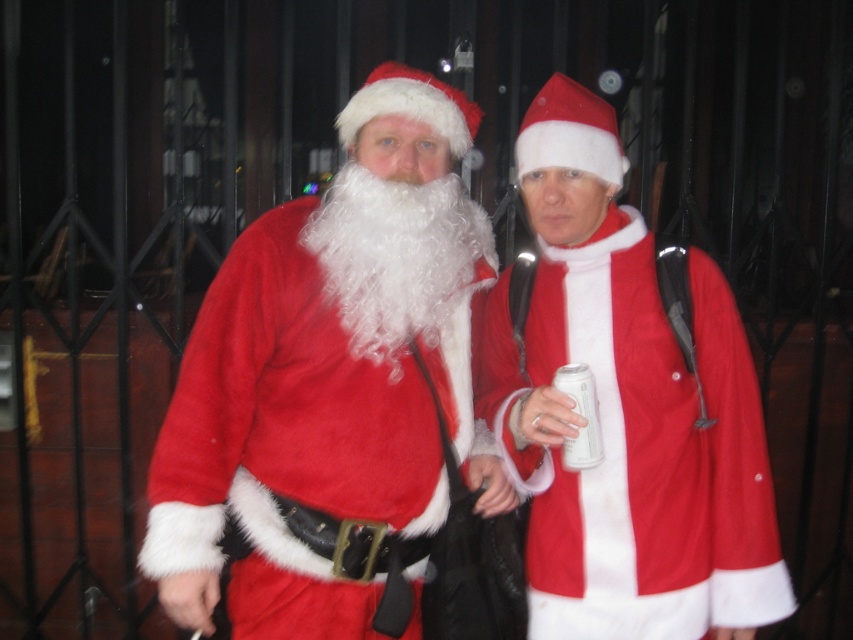
You are a photographer trying to capture a clear photo of both the white curly fur beard at center and the white matte can at center. The minimum distance your camera lens can focus on two objects clearly is 40 centimeters. Can you take a photo where both objects are in focus?

The white curly fur beard at center and white matte can at center are 41.05 centimeters apart, which exceeds the camera lens minimum focusing distance of 40 centimeters. Therefore, the camera can clearly focus on both objects.